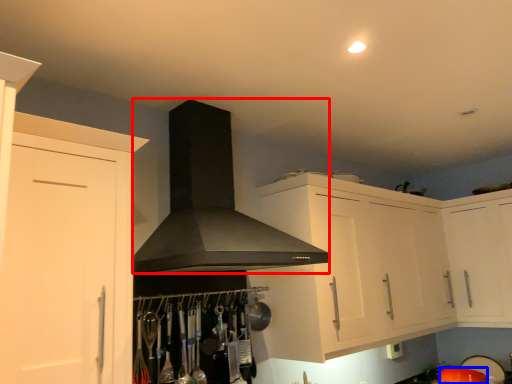
Question: Among these objects, which one is nearest to the camera, fume hood (highlighted by a red box) or appliance (highlighted by a blue box)?

Choices:
 (A) fume hood
 (B) appliance

Answer: (A)